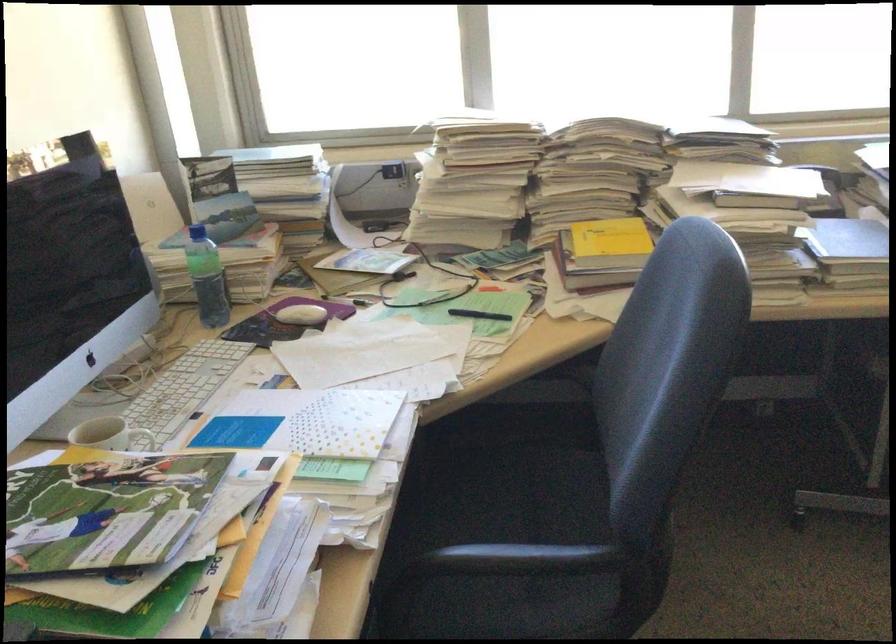
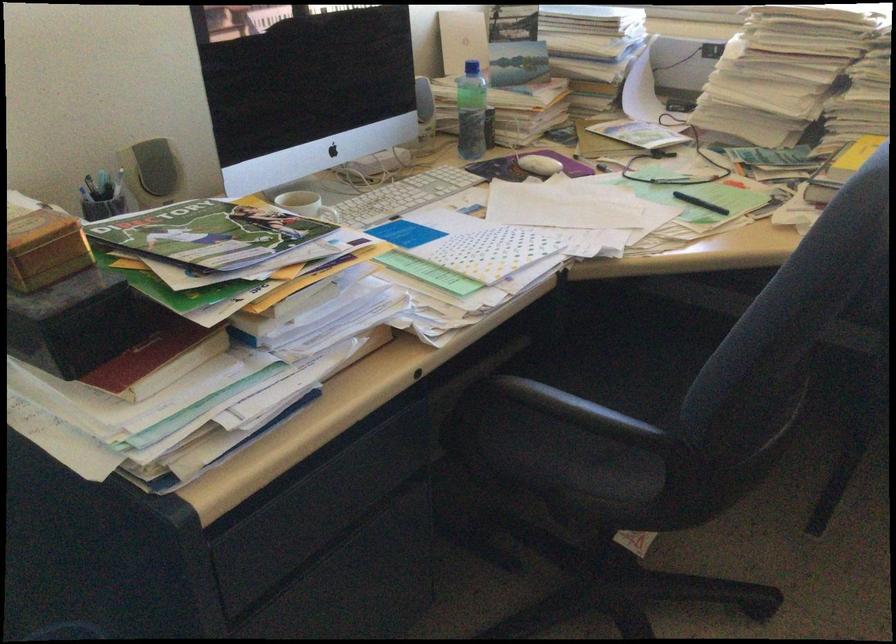
Locate, in the second image, the point that corresponds to point 471,495 in the first image.

(618, 365)